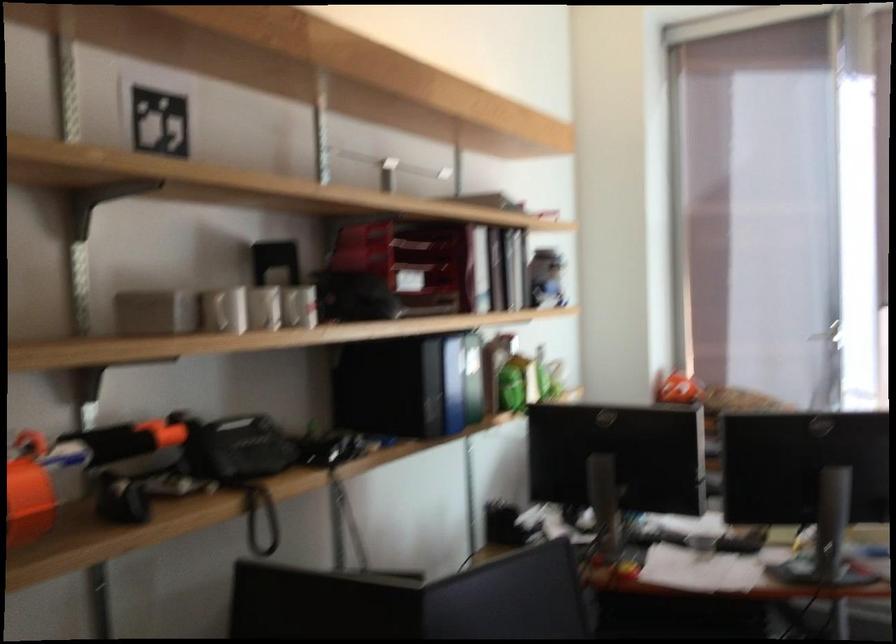
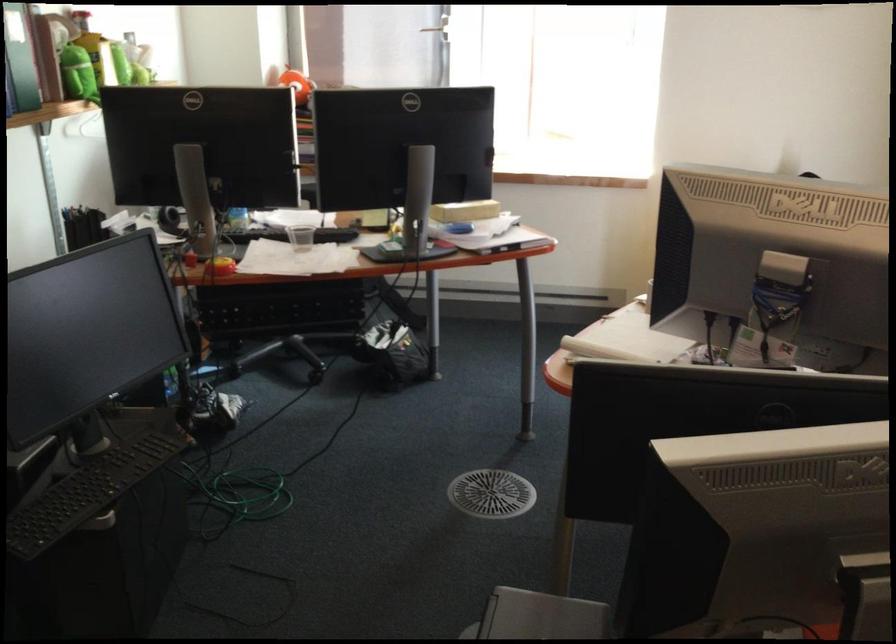
In the second image, find the point that corresponds to point 686,389 in the first image.

(297, 84)